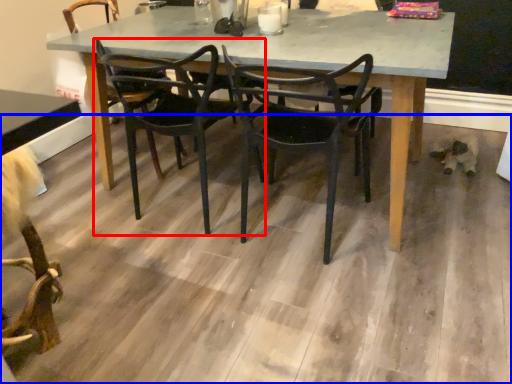
Question: Which object is further to the camera taking this photo, chair (highlighted by a red box) or concrete (highlighted by a blue box)?

Choices:
 (A) chair
 (B) concrete

Answer: (A)